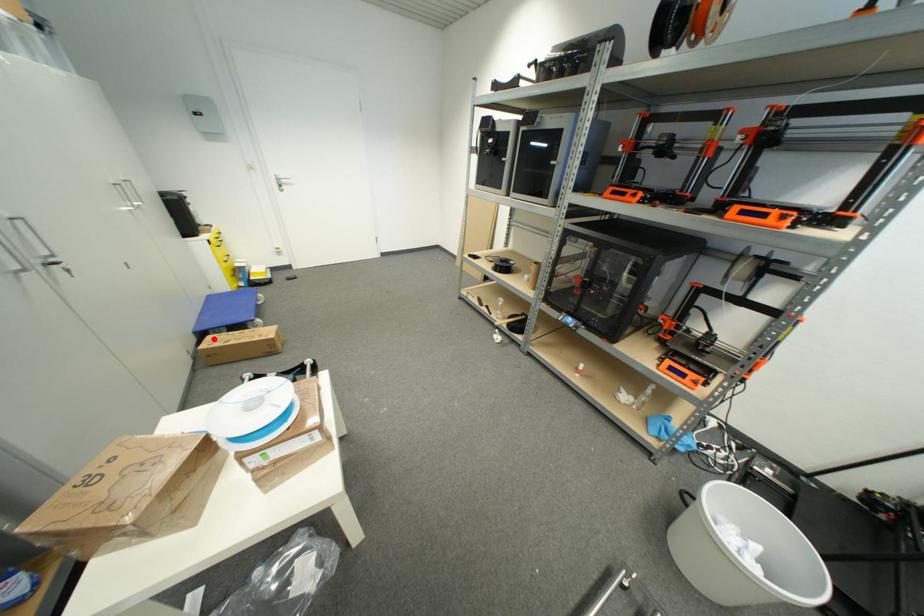
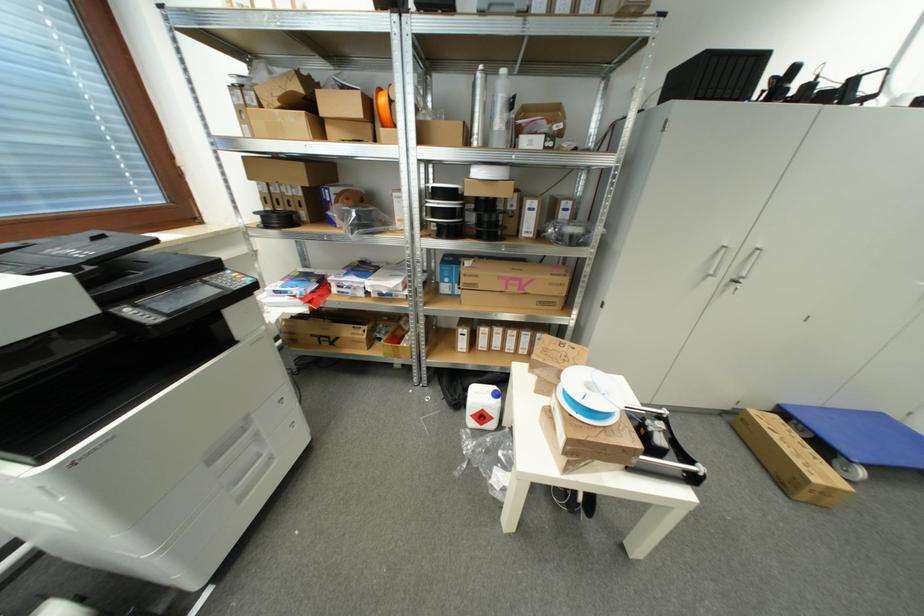
In the second image, find the point that corresponds to the highlighted location in the first image.

(781, 419)